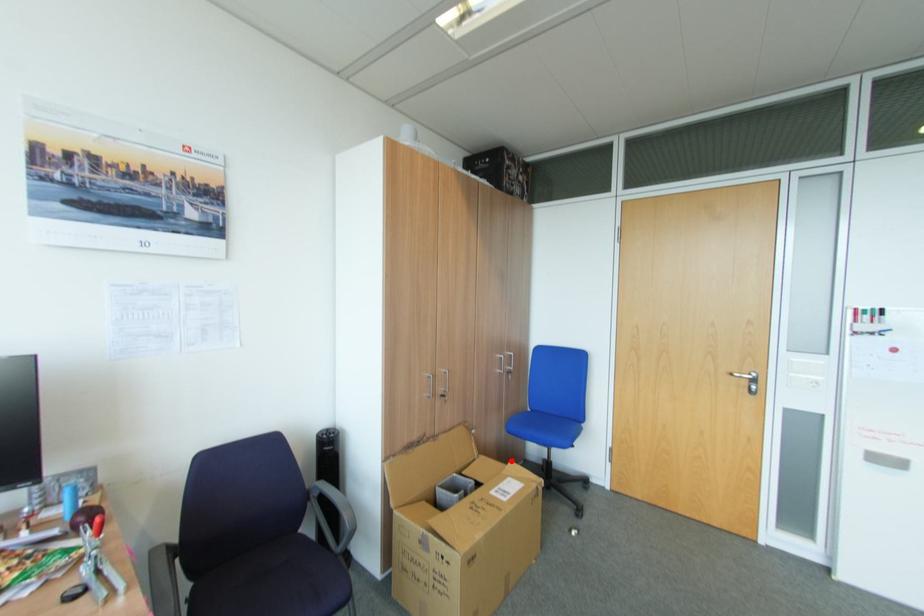
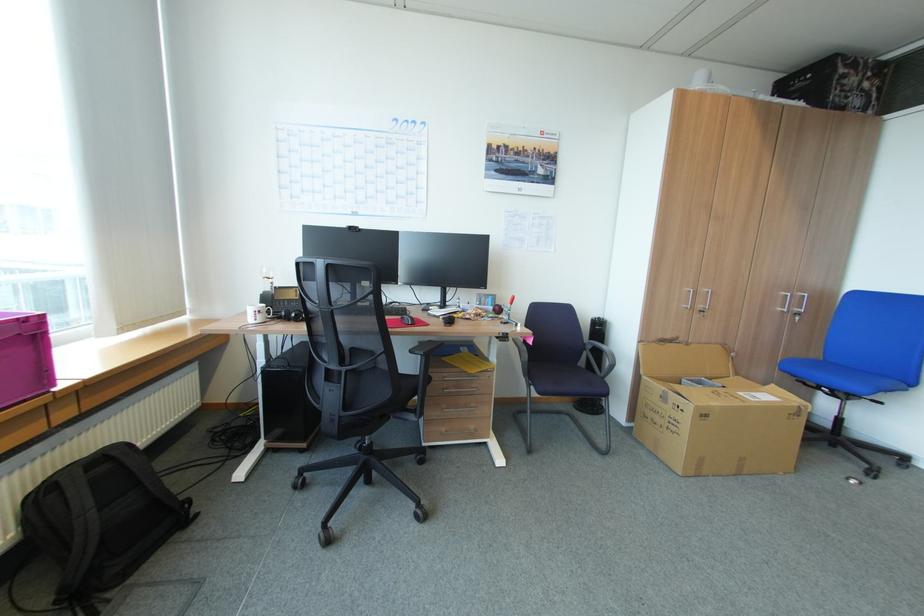
Find the pixel in the second image that matches the highlighted location in the first image.

(771, 384)